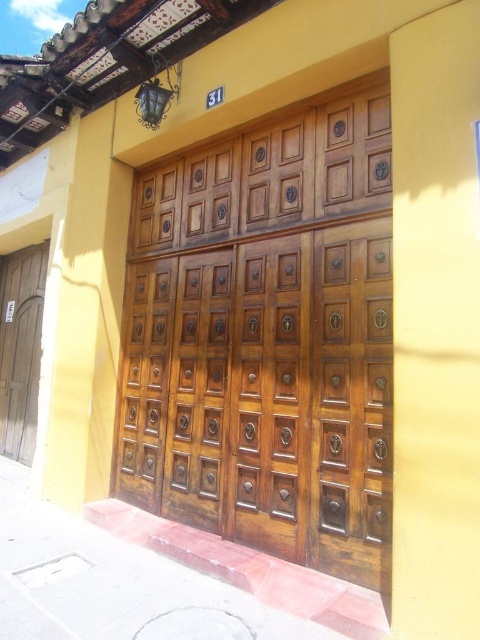
Question: From the image, what is the correct spatial relationship of polished wood door at center in relation to wooden door at left?

Choices:
 (A) left
 (B) right

Answer: (B)

Question: Among these points, which one is nearest to the camera?

Choices:
 (A) (340, 385)
 (B) (24, 268)

Answer: (A)

Question: Is polished wood door at center in front of wooden door at left?

Choices:
 (A) no
 (B) yes

Answer: (B)

Question: Which point is closer to the camera?

Choices:
 (A) (12, 346)
 (B) (225, 416)

Answer: (B)

Question: Is polished wood door at center below wooden door at left?

Choices:
 (A) yes
 (B) no

Answer: (B)